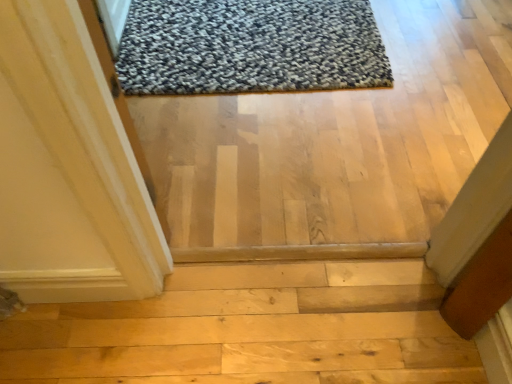
This screenshot has width=512, height=384. What do you see at coordinates (250, 47) in the screenshot?
I see `textured gray rug at upper center` at bounding box center [250, 47].

Locate an element on the screen. Image resolution: width=512 pixels, height=384 pixels. textured gray rug at upper center is located at coordinates (250, 47).

I want to click on natural wood stairs at center, so pos(250,330).

The image size is (512, 384). Describe the element at coordinates (250, 330) in the screenshot. I see `natural wood stairs at center` at that location.

This screenshot has width=512, height=384. In order to click on textured gray rug at upper center in this screenshot , I will do `click(250, 47)`.

Considering the positions of objects natural wood stairs at center and textured gray rug at upper center in the image provided, who is more to the left, natural wood stairs at center or textured gray rug at upper center?

From the viewer's perspective, natural wood stairs at center appears more on the left side.

Which is in front, natural wood stairs at center or textured gray rug at upper center?

natural wood stairs at center is closer to the camera.

Is point (273, 272) farther from camera compared to point (354, 44)?

That is False.

From the image's perspective, does natural wood stairs at center appear higher than textured gray rug at upper center?

No, from the image's perspective, natural wood stairs at center is not above textured gray rug at upper center.

From a real-world perspective, is natural wood stairs at center positioned over textured gray rug at upper center based on gravity?

No, from a real-world perspective, natural wood stairs at center is not on top of textured gray rug at upper center.

Which of these two, natural wood stairs at center or textured gray rug at upper center, is wider?

Wider between the two is textured gray rug at upper center.

In the scene shown: Does natural wood stairs at center have a lesser height compared to textured gray rug at upper center?

In fact, natural wood stairs at center may be taller than textured gray rug at upper center.

Considering the sizes of natural wood stairs at center and textured gray rug at upper center in the image, is natural wood stairs at center bigger or smaller than textured gray rug at upper center?

Clearly, natural wood stairs at center is larger in size than textured gray rug at upper center.

Is natural wood stairs at center outside of textured gray rug at upper center?

Indeed, natural wood stairs at center is completely outside textured gray rug at upper center.

Are natural wood stairs at center and textured gray rug at upper center far apart?

That's right, there is a large distance between natural wood stairs at center and textured gray rug at upper center.

Looking at this image, does natural wood stairs at center turn towards textured gray rug at upper center?

Yes, natural wood stairs at center is oriented towards textured gray rug at upper center.

How far apart are natural wood stairs at center and textured gray rug at upper center?

natural wood stairs at center and textured gray rug at upper center are 3.75 feet apart.

This screenshot has height=384, width=512. In order to click on stairwell directly beneath the textured gray rug at upper center (from a real-world perspective) in this screenshot , I will do `click(250, 330)`.

Considering the positions of objects textured gray rug at upper center and natural wood stairs at center in the image provided, who is more to the left, textured gray rug at upper center or natural wood stairs at center?

Positioned to the left is natural wood stairs at center.

Relative to natural wood stairs at center, is textured gray rug at upper center in front or behind?

In the image, textured gray rug at upper center appears behind natural wood stairs at center.

Does point (260, 79) come closer to viewer compared to point (271, 306)?

That is False.

From the image's perspective, which is above, textured gray rug at upper center or natural wood stairs at center?

textured gray rug at upper center.

From a real-world perspective, between textured gray rug at upper center and natural wood stairs at center, who is vertically higher?

In real-world perspective, textured gray rug at upper center is above.

Looking at their sizes, would you say textured gray rug at upper center is wider or thinner than natural wood stairs at center?

textured gray rug at upper center is wider than natural wood stairs at center.

Can you confirm if textured gray rug at upper center is taller than natural wood stairs at center?

No, textured gray rug at upper center is not taller than natural wood stairs at center.

Looking at this image, considering the sizes of objects textured gray rug at upper center and natural wood stairs at center in the image provided, who is bigger, textured gray rug at upper center or natural wood stairs at center?

natural wood stairs at center is bigger.

Which is correct: textured gray rug at upper center is inside natural wood stairs at center, or outside of it?

textured gray rug at upper center is outside natural wood stairs at center.

Is textured gray rug at upper center next to natural wood stairs at center and touching it?

No, textured gray rug at upper center is not making contact with natural wood stairs at center.

Is textured gray rug at upper center oriented towards natural wood stairs at center?

Yes, textured gray rug at upper center is oriented towards natural wood stairs at center.

Locate an element on the screen. stairwell lying below the textured gray rug at upper center (from the image's perspective) is located at coordinates (250, 330).

This screenshot has height=384, width=512. I want to click on stairwell below the textured gray rug at upper center (from the image's perspective), so [250, 330].

What are the coordinates of `stairwell in front of the textured gray rug at upper center` in the screenshot? It's located at (x=250, y=330).